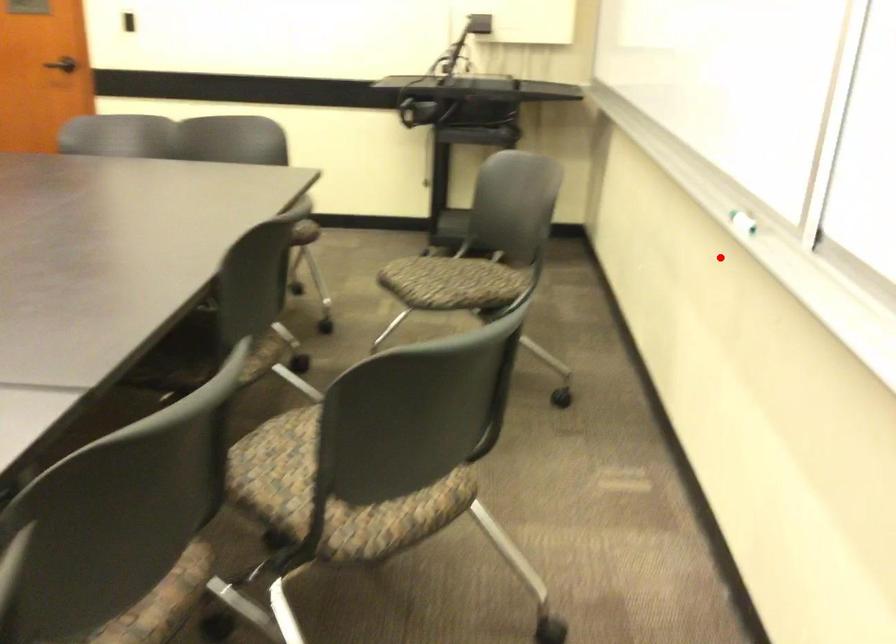
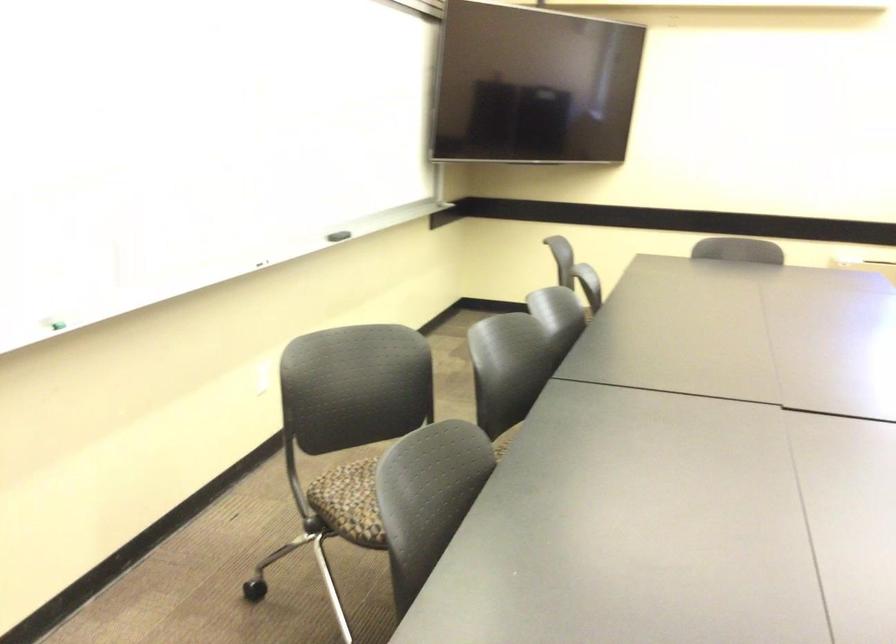
Where in the second image is the point corresponding to the highlighted location from the first image?

(55, 325)